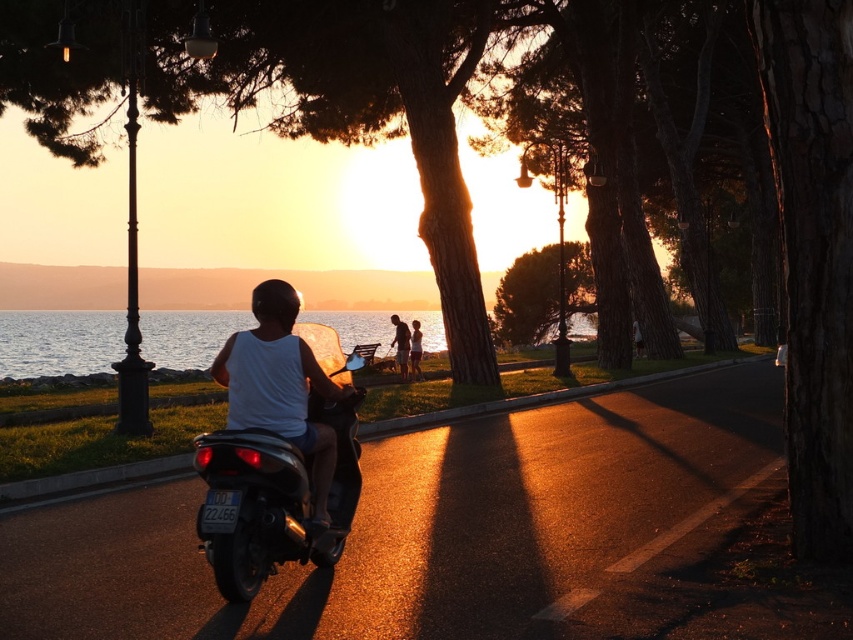
Question: Does white matte tank top at center have a lesser width compared to smooth white shirt at center?

Choices:
 (A) no
 (B) yes

Answer: (A)

Question: Is white matte tank top at center further to the viewer compared to smooth white shirt at center?

Choices:
 (A) yes
 (B) no

Answer: (B)

Question: Which object is closer to the camera taking this photo?

Choices:
 (A) smooth white shirt at center
 (B) white matte tank top at center

Answer: (B)

Question: Which of the following is the farthest from the observer?

Choices:
 (A) pyautogui.click(x=299, y=404)
 (B) pyautogui.click(x=395, y=348)

Answer: (B)

Question: Which point is closer to the camera?

Choices:
 (A) (254, 397)
 (B) (399, 349)

Answer: (A)

Question: Is white matte tank top at center positioned at the back of smooth white shirt at center?

Choices:
 (A) yes
 (B) no

Answer: (B)